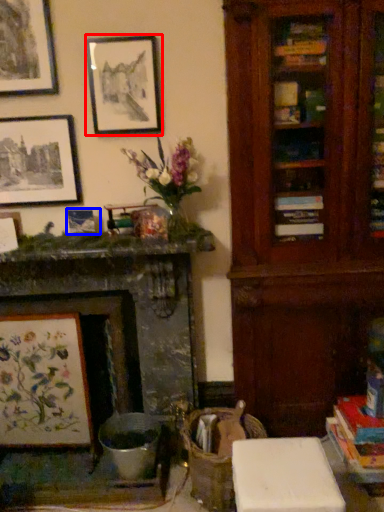
Question: Which object is further to the camera taking this photo, picture frame (highlighted by a red box) or picture frame (highlighted by a blue box)?

Choices:
 (A) picture frame
 (B) picture frame

Answer: (B)